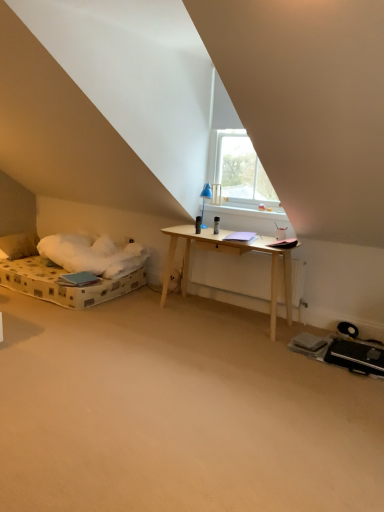
Describe the element at coordinates (234, 151) in the screenshot. I see `transparent glass window at upper center` at that location.

Locate an element on the screen. This screenshot has height=512, width=384. transparent glass window at upper center is located at coordinates (234, 151).

Where is `soft white pillow at left`? This screenshot has width=384, height=512. soft white pillow at left is located at coordinates (19, 245).

The height and width of the screenshot is (512, 384). In order to click on beige carpet at center in this screenshot , I will do (x=178, y=412).

From a real-world perspective, is soft white pillow at left above or below beige carpet at center?

From a real-world perspective, soft white pillow at left is physically above beige carpet at center.

Based on the photo, from the image's perspective, does soft white pillow at left appear higher than beige carpet at center?

Yes, from the image's perspective, soft white pillow at left is over beige carpet at center.

Which point is more distant from viewer, (20, 238) or (29, 362)?

Point (20, 238)

Visually, is soft white pillow at left positioned to the left or to the right of beige carpet at center?

Clearly, soft white pillow at left is on the left of beige carpet at center in the image.

Considering the relative sizes of transparent glass window at upper center and soft white pillow at left in the image provided, is transparent glass window at upper center taller than soft white pillow at left?

Yes, transparent glass window at upper center is taller than soft white pillow at left.

Between transparent glass window at upper center and soft white pillow at left, which one has smaller width?

transparent glass window at upper center is thinner.

Is transparent glass window at upper center at the left side of soft white pillow at left?

No, transparent glass window at upper center is not to the left of soft white pillow at left.

Is beige carpet at center turned away from transparent glass window at upper center?

Answer: No, beige carpet at center is not facing the opposite direction of transparent glass window at upper center.

Which object is thinner, beige carpet at center or transparent glass window at upper center?

transparent glass window at upper center.

Considering their positions, is beige carpet at center located in front of or behind transparent glass window at upper center?

beige carpet at center is in front of transparent glass window at upper center.

Considering the sizes of objects beige carpet at center and transparent glass window at upper center in the image provided, who is taller, beige carpet at center or transparent glass window at upper center?

Standing taller between the two is transparent glass window at upper center.

Is soft white pillow at left positioned far away from transparent glass window at upper center?

Yes, soft white pillow at left is far from transparent glass window at upper center.

Looking at this image, is soft white pillow at left positioned behind transparent glass window at upper center?

Yes.

From the image's perspective, is soft white pillow at left above or below transparent glass window at upper center?

soft white pillow at left is below transparent glass window at upper center.

Identify the location of window located on the right of soft white pillow at left. (234, 151).

Identify the location of window positioned vertically above the beige carpet at center (from a real-world perspective). pos(234,151).

From the image's perspective, is transparent glass window at upper center under beige carpet at center?

No.

Is beige carpet at center not inside soft white pillow at left?

Yes, beige carpet at center is outside of soft white pillow at left.

What's the angular difference between beige carpet at center and soft white pillow at left's facing directions?

beige carpet at center and soft white pillow at left are facing 0.253 degrees away from each other.

In terms of width, does beige carpet at center look wider or thinner when compared to soft white pillow at left?

beige carpet at center is wider than soft white pillow at left.

Which is more to the right, beige carpet at center or soft white pillow at left?

From the viewer's perspective, beige carpet at center appears more on the right side.

Identify the location of plain below the soft white pillow at left (from the image's perspective). The image size is (384, 512). (178, 412).

Locate an element on the screen. window that appears on the right of soft white pillow at left is located at coordinates (234, 151).

Which object lies further to the anchor point beige carpet at center, transparent glass window at upper center or soft white pillow at left?

soft white pillow at left.

Which object lies nearer to the anchor point transparent glass window at upper center, soft white pillow at left or beige carpet at center?

The object closer to transparent glass window at upper center is beige carpet at center.

Which object lies further to the anchor point transparent glass window at upper center, beige carpet at center or soft white pillow at left?

The object further to transparent glass window at upper center is soft white pillow at left.

Looking at the image, which one is located closer to beige carpet at center, soft white pillow at left or transparent glass window at upper center?

transparent glass window at upper center is positioned closer to the anchor beige carpet at center.

Estimate the real-world distances between objects in this image. Which object is closer to soft white pillow at left, transparent glass window at upper center or beige carpet at center?

transparent glass window at upper center is closer to soft white pillow at left.

When comparing their distances from soft white pillow at left, does beige carpet at center or transparent glass window at upper center seem closer?

transparent glass window at upper center is positioned closer to the anchor soft white pillow at left.

This screenshot has width=384, height=512. Find the location of `window positioned between beige carpet at center and soft white pillow at left from near to far`. window positioned between beige carpet at center and soft white pillow at left from near to far is located at coordinates (234, 151).